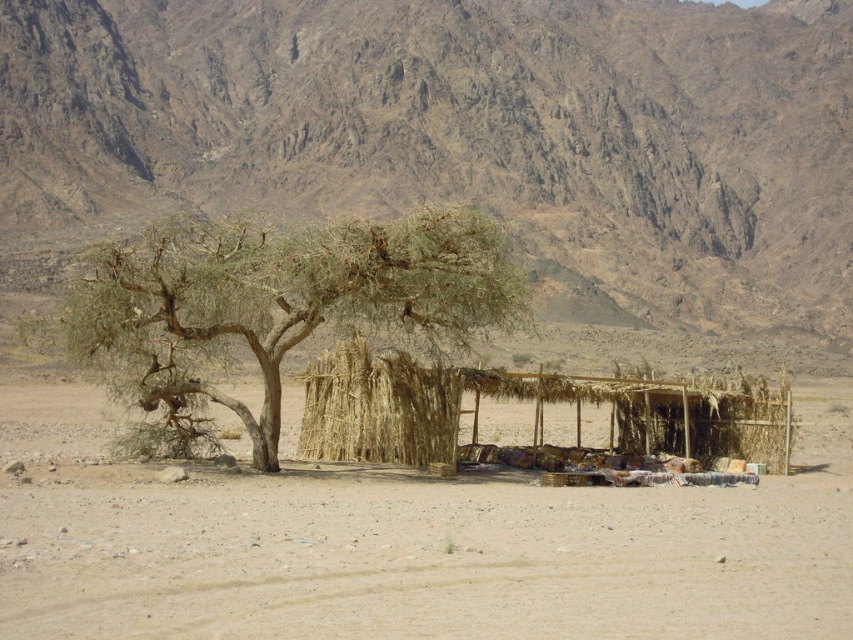
You are planning to set up a campsite near the shelter. Considering the brown rocky mountain at upper center and the green leafy tree at center, which one has a wider base that could provide more shelter from the wind?

The brown rocky mountain at upper center has a wider base than the green leafy tree at center, so it would provide more shelter from the wind.

You are planning to build a small garden near the shelter. Based on the image, which object is closer to you if you are standing at the shelter? The brown rocky mountain at upper center or the brown sandy ground at center?

The brown rocky mountain at upper center is closer to you because the brown sandy ground at center is behind it.

You are planning to set up a campsite near the brown rocky mountain at upper center and the green leafy tree at center. Which object would require more space due to its size?

The brown rocky mountain at upper center requires more space because it is larger in size than the green leafy tree at center.